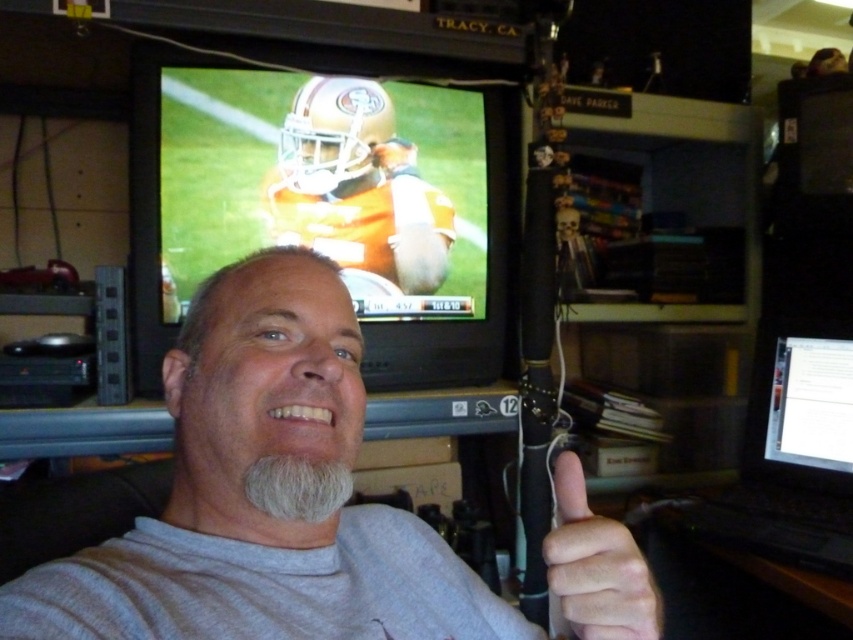
You are trying to locate the gray matte shirt at center in the image. Since you can see the black plastic laptop at right, can you determine if the shirt is placed above or below it?

The gray matte shirt at center is positioned over the black plastic laptop at right, meaning it is placed above the laptop.

Where is the orange glossy tv at upper center located in the image?

The orange glossy tv at upper center is located at point (x=326, y=205) in the image.